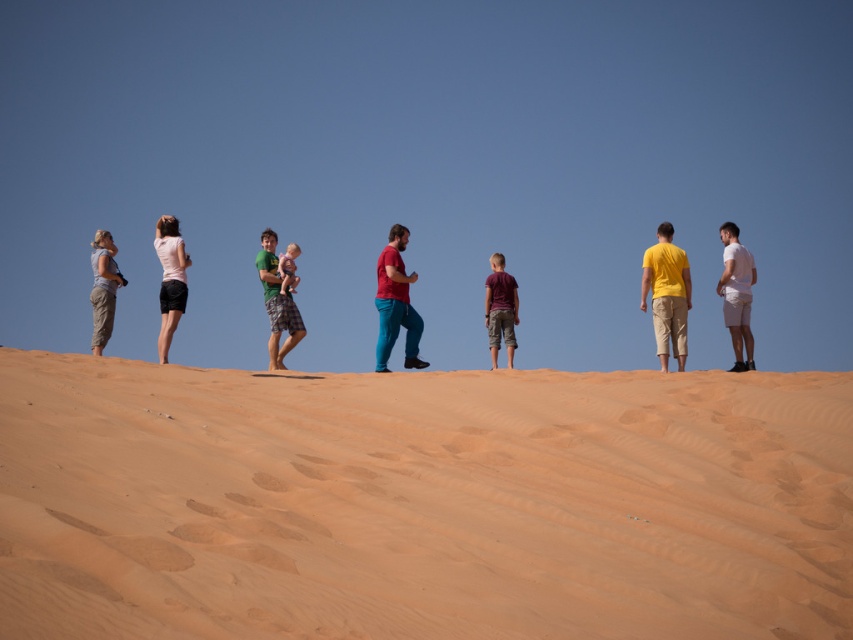
You are a photographer trying to capture a photo of the group on the dune. You notice two people wearing green plaid shorts at center and matte khaki pants at left. Which person should you focus on to ensure they are in the foreground of the photo?

The green plaid shorts at center is much taller than matte khaki pants at left, so focusing on the green plaid shorts at center will place them in the foreground since taller objects appear closer in such compositions.

You are a photographer positioned at the camera location. You want to capture a photo of the matte pink shirt at left without including any other people in the frame. Is this possible given the distance?

The matte pink shirt at left is 74.56 feet away from camera, so yes, it is possible to capture a photo of the matte pink shirt at left without including any other people in the frame as it is sufficiently distant from the camera.

You are standing on the sand dune and see the group. What is the color of the clothing item located at point (170, 280)?

The clothing item at point (170, 280) is a matte pink shirt at left.